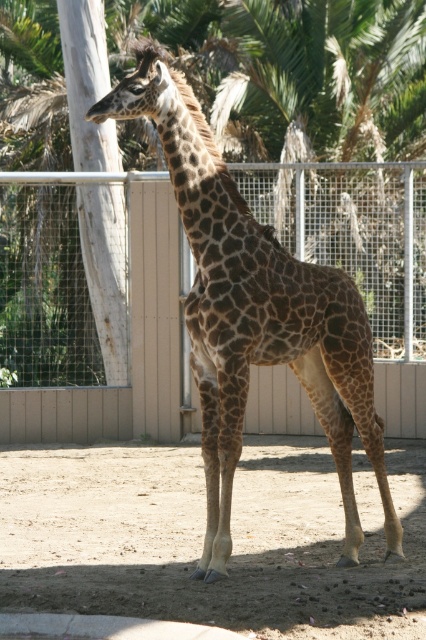
Does brown spotted giraffe at center appear on the right side of metal mesh fence at center?

In fact, brown spotted giraffe at center is to the left of metal mesh fence at center.

Is brown spotted giraffe at center thinner than metal mesh fence at center?

Yes.

Locate an element on the screen. brown spotted giraffe at center is located at coordinates (253, 312).

Can you confirm if brown sandy dirt at center is positioned to the right of brown spotted giraffe at center?

Indeed, brown sandy dirt at center is positioned on the right side of brown spotted giraffe at center.

Is brown sandy dirt at center shorter than brown spotted giraffe at center?

Indeed, brown sandy dirt at center has a lesser height compared to brown spotted giraffe at center.

I want to click on brown sandy dirt at center, so click(203, 534).

Which is more to the left, brown sandy dirt at center or metal mesh fence at center?

brown sandy dirt at center is more to the left.

Who is lower down, brown sandy dirt at center or metal mesh fence at center?

brown sandy dirt at center is below.

Which is in front, point (120, 563) or point (14, 243)?

Point (120, 563) is more forward.

This screenshot has width=426, height=640. In order to click on brown sandy dirt at center in this screenshot , I will do `click(203, 534)`.